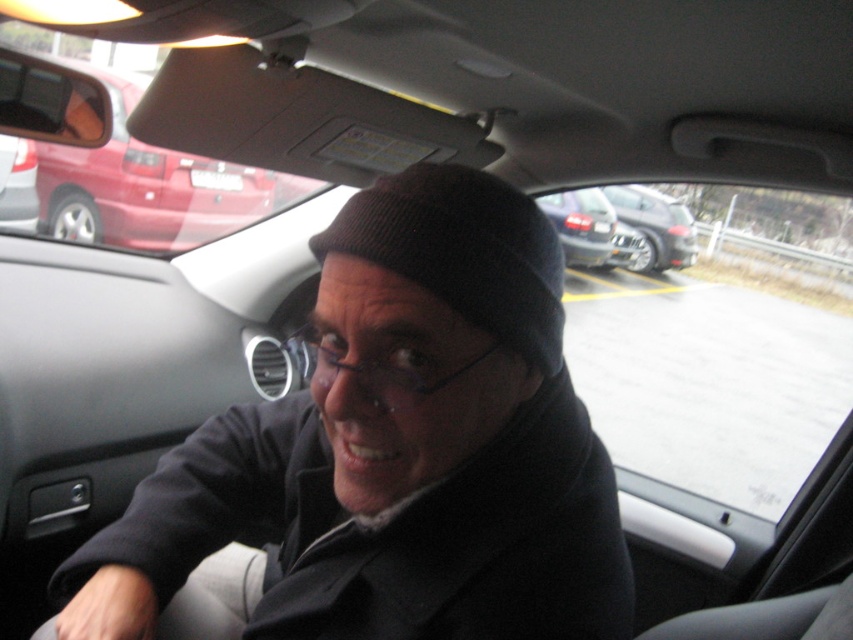
You are a passenger in the car and need to determine which object is narrower between the black knit cap at center and the metallic silver suv at center. Which one is narrower?

The black knit cap at center is thinner than the metallic silver suv at center, so the black knit cap at center is narrower.

You are sitting in the passenger seat of the car and want to reach a point marked at coordinates point (498, 220). Your arm can extend 24 inches. Can you comfortably reach that point?

The point (498, 220) is 23.99 inches away from the viewer, so yes, you can comfortably reach it since your arm can extend 24 inches.